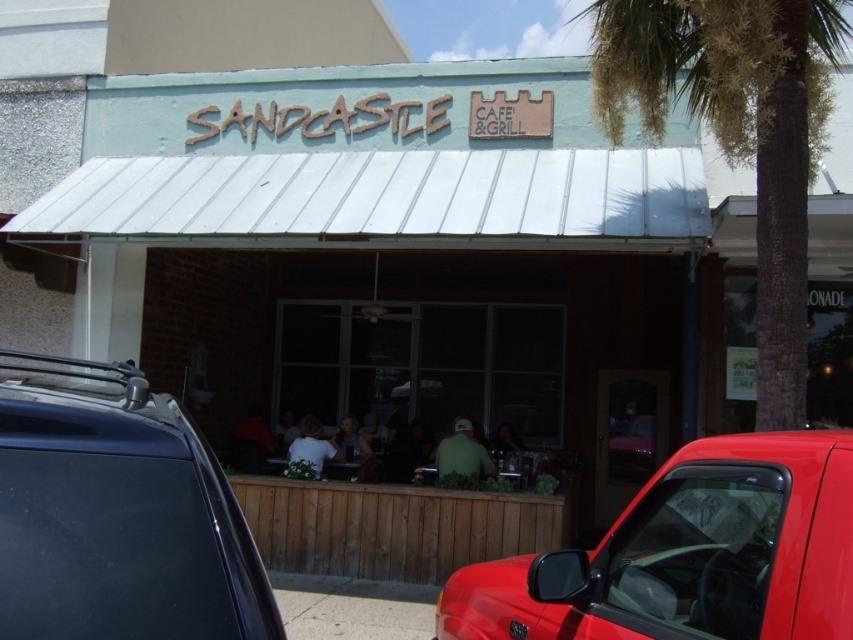
You are a customer arriving at the Sandcastle Cafe and Grill. You see the shiny red truck at lower right and the green leafy palm tree at upper right. Which object is closer to the entrance of the cafe?

The shiny red truck at lower right is closer to the entrance of the cafe because it is positioned below the green leafy palm tree at upper right, indicating it is lower in the image and thus nearer to the entrance.

You are standing at the entrance of the Sandcastle Cafe and Grill. You notice a point at coordinates (x=119, y=516). What object is located at that point?

At point (x=119, y=516) lies a matte black car at center.

You are a customer waiting to enter the Sandcastle Cafe and Grill. You see the shiny red truck at lower right and the green leafy palm tree at upper right. Which object is closer to the entrance of the cafe?

The shiny red truck at lower right is closer to the entrance of the cafe because it is in front of the green leafy palm tree at upper right.